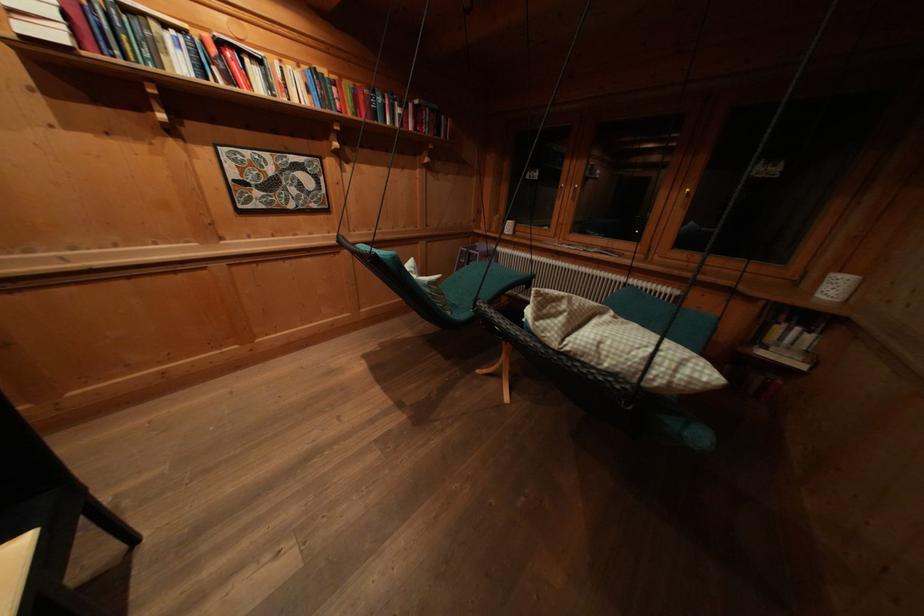
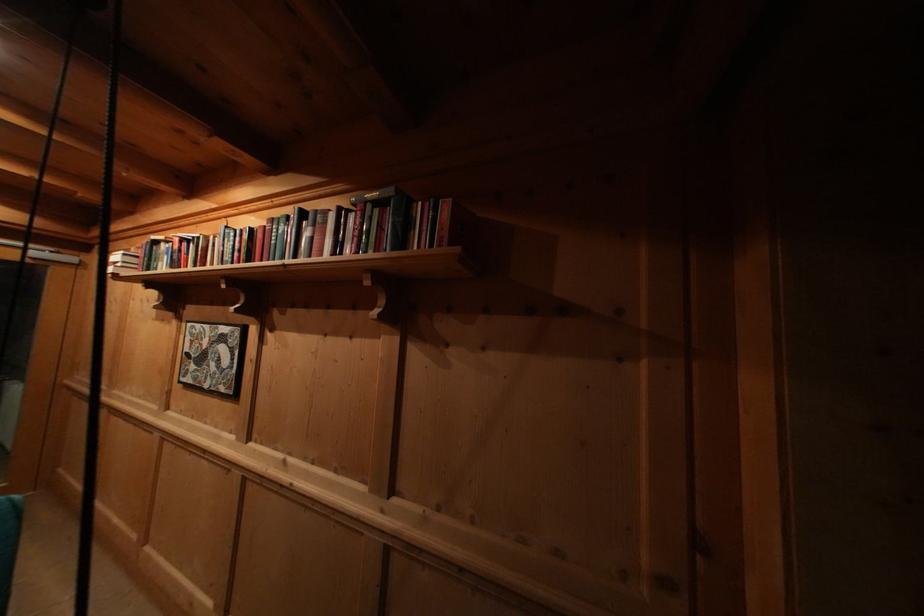
Locate, in the second image, the point that corresponds to the point at 341,94 in the first image.

(244, 245)